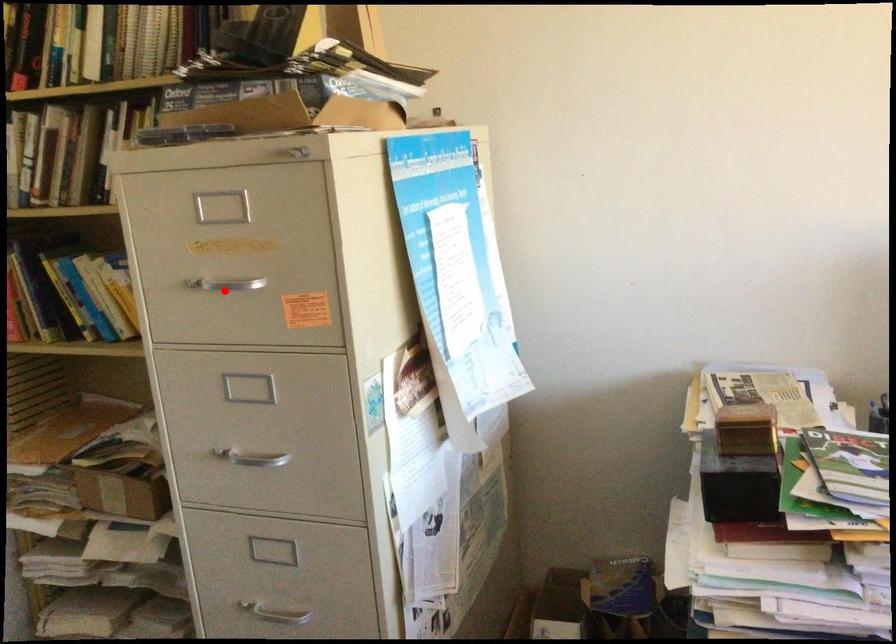
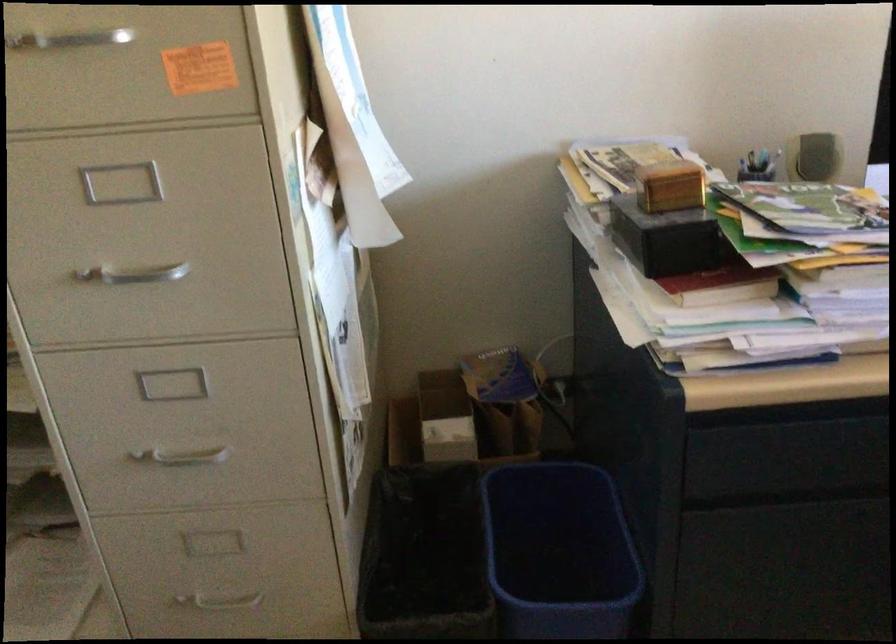
Question: I am providing you with two images of the same scene from different viewpoints. In image1, a red point is highlighted. Considering the same 3D point in image2, which of the following is correct?

Choices:
 (A) It is closer
 (B) It is farther

Answer: (A)